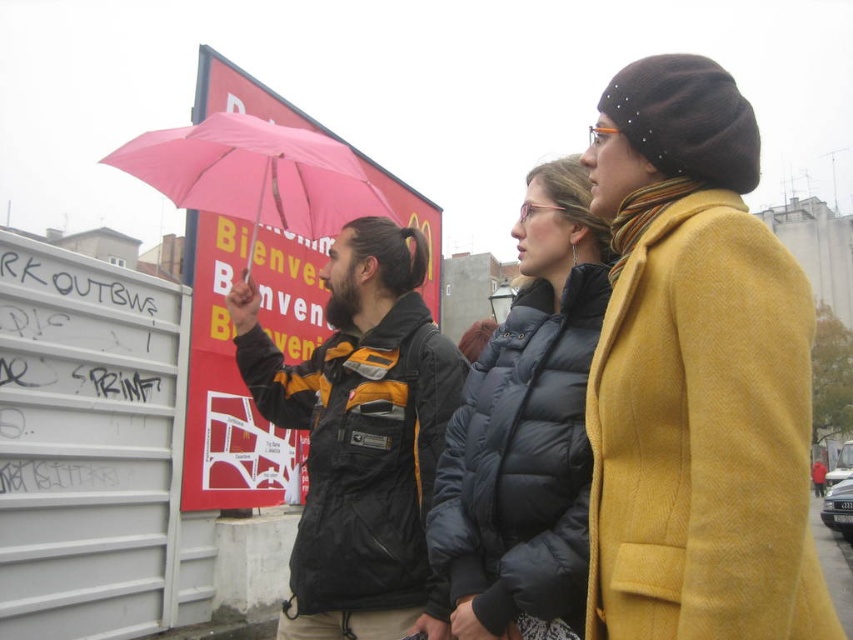
You are a photographer trying to capture a candid shot of the mustard woolen coat at right and the black and yellow jacket at center. Since you want both subjects in the frame, which direction should you move your camera to ensure both are visible?

The mustard woolen coat at right is to the right of the black and yellow jacket at center. To capture both in the frame, you should move your camera slightly to the right to include the mustard woolen coat at right while keeping the black and yellow jacket at center in view.

You are standing at point [641,365] and want to walk to the group of people in the scene. Given that the distance between you and the group is 72.87 feet, can you estimate whether you can comfortably walk to them without any obstacles? Please consider the urban setting described.

The distance between you at point [641,365] and the group is 72.87 feet. In an urban setting, this distance is manageable for walking, so you can comfortably reach them unless there are obstacles like buildings or signage in the way.

You are a photographer trying to capture a candid shot of the black and yellow jacket at center without including the mustard woolen coat at right in the frame. Is this possible given their positions?

The mustard woolen coat at right is in front of the black and yellow jacket at center, so it would block the view. Therefore, capturing the black and yellow jacket at center without the mustard woolen coat at right in the frame is not possible unless you move around the obstruction.